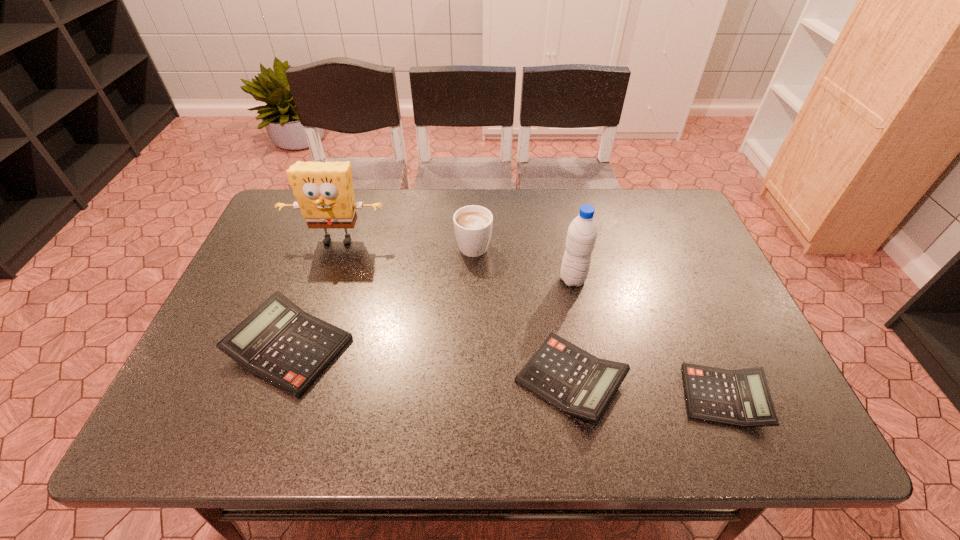
In order to click on free space that is in between the sponge and the rightmost object in this screenshot , I will do `click(531, 319)`.

Find the location of a particular element. The height and width of the screenshot is (540, 960). vacant space in between the rightmost calculator and the second tallest calculator is located at coordinates (647, 388).

Locate an element on the screen. unoccupied area between the sponge and the second calculator from left to right is located at coordinates (454, 310).

This screenshot has width=960, height=540. What are the coordinates of `vacant area that lies between the fourth object from right to left and the sponge` in the screenshot? It's located at (406, 242).

Locate an element on the screen. The image size is (960, 540). unoccupied area between the shortest object and the cappuccino is located at coordinates (599, 320).

Locate an element on the screen. The height and width of the screenshot is (540, 960). vacant space in between the leftmost calculator and the second shortest calculator is located at coordinates (430, 364).

Find the location of a particular element. Image resolution: width=960 pixels, height=540 pixels. free space between the second calculator from left to right and the shortest calculator is located at coordinates (647, 388).

The height and width of the screenshot is (540, 960). I want to click on free space between the leftmost calculator and the shortest object, so click(507, 373).

The height and width of the screenshot is (540, 960). In order to click on object that ranks as the fifth closest to the cappuccino in this screenshot , I will do `click(741, 398)`.

Select which object appears as the fifth closest to the second tallest calculator. Please provide its 2D coordinates. Your answer should be formatted as a tuple, i.e. [(x, y)], where the tuple contains the x and y coordinates of a point satisfying the conditions above.

[(324, 191)]